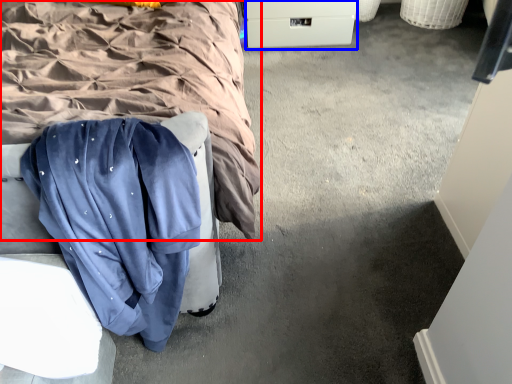
Question: Which object is closer to the camera taking this photo, bed (highlighted by a red box) or drawer (highlighted by a blue box)?

Choices:
 (A) bed
 (B) drawer

Answer: (A)